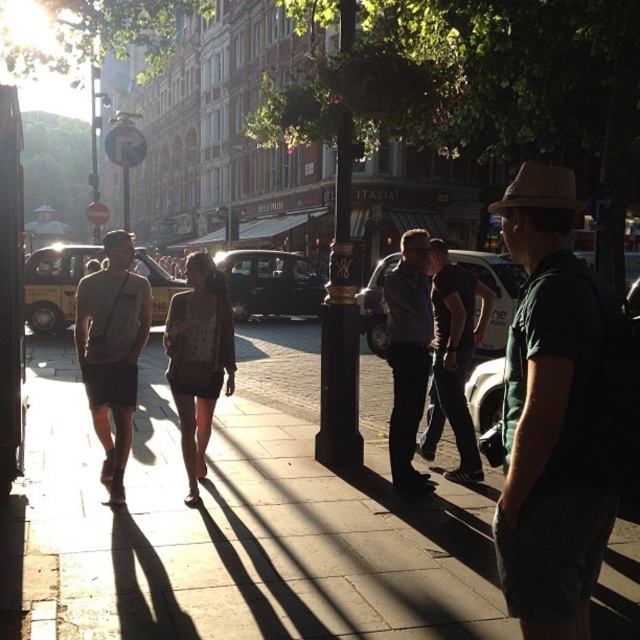
Question: Can you confirm if green cotton shirt at right is thinner than dark gray shirt at center?

Choices:
 (A) no
 (B) yes

Answer: (B)

Question: Among these points, which one is nearest to the camera?

Choices:
 (A) (195, 406)
 (B) (128, 518)
 (C) (468, 420)

Answer: (B)

Question: Is black polished metal pole at center to the left of dark blue shirt at center from the viewer's perspective?

Choices:
 (A) yes
 (B) no

Answer: (A)

Question: Which object is positioned closest to the black polished metal pole at center?

Choices:
 (A) dark gray shirt at center
 (B) brown textured coat at center

Answer: (A)

Question: Is brown textured coat at center below dark gray shirt at center?

Choices:
 (A) yes
 (B) no

Answer: (A)

Question: Which point appears closest to the camera in this image?

Choices:
 (A) (568, 353)
 (B) (97, 337)

Answer: (A)